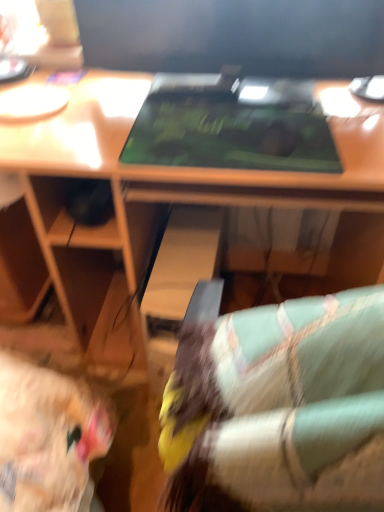
Question: From a real-world perspective, is green matte laptop at center located higher than matte black monitor at upper center?

Choices:
 (A) yes
 (B) no

Answer: (B)

Question: From the image's perspective, is green matte laptop at center under matte black monitor at upper center?

Choices:
 (A) yes
 (B) no

Answer: (A)

Question: Would you say green matte laptop at center is a long distance from matte black monitor at upper center?

Choices:
 (A) yes
 (B) no

Answer: (B)

Question: Is green matte laptop at center to the right of matte black monitor at upper center from the viewer's perspective?

Choices:
 (A) yes
 (B) no

Answer: (B)

Question: Is green matte laptop at center bigger than matte black monitor at upper center?

Choices:
 (A) no
 (B) yes

Answer: (A)

Question: Is matte black monitor at upper center a part of green matte laptop at center?

Choices:
 (A) yes
 (B) no

Answer: (B)

Question: Does matte black monitor at upper center have a smaller size compared to green matte laptop at center?

Choices:
 (A) yes
 (B) no

Answer: (B)

Question: From a real-world perspective, is matte black monitor at upper center on top of green matte laptop at center?

Choices:
 (A) yes
 (B) no

Answer: (A)

Question: From the image's perspective, does matte black monitor at upper center appear higher than green matte laptop at center?

Choices:
 (A) no
 (B) yes

Answer: (B)

Question: Is matte black monitor at upper center positioned far away from green matte laptop at center?

Choices:
 (A) no
 (B) yes

Answer: (A)

Question: From a real-world perspective, is matte black monitor at upper center under green matte laptop at center?

Choices:
 (A) no
 (B) yes

Answer: (A)

Question: Would you say matte black monitor at upper center contains green matte laptop at center?

Choices:
 (A) yes
 (B) no

Answer: (B)

Question: Considering the positions of point (292, 109) and point (354, 60), is point (292, 109) closer or farther from the camera than point (354, 60)?

Choices:
 (A) closer
 (B) farther

Answer: (A)